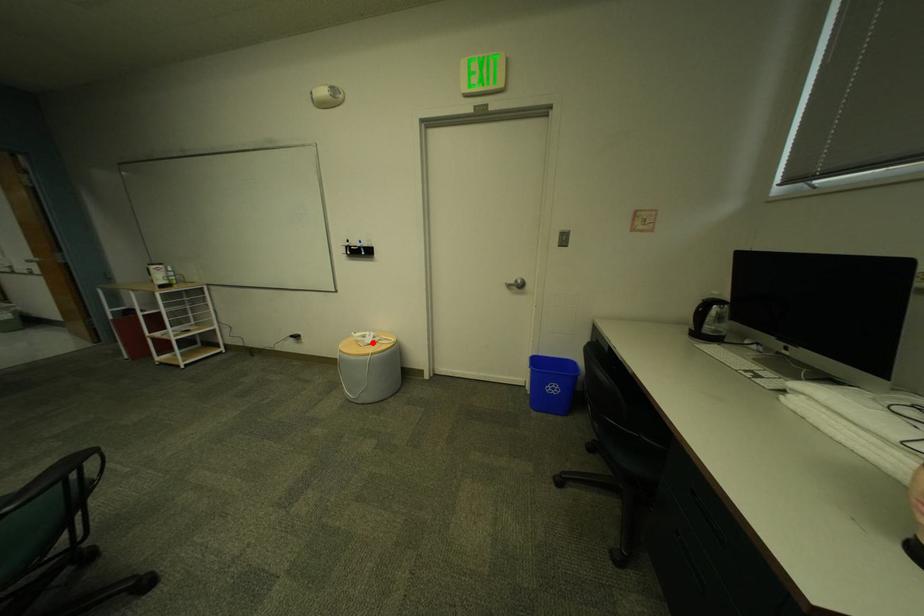
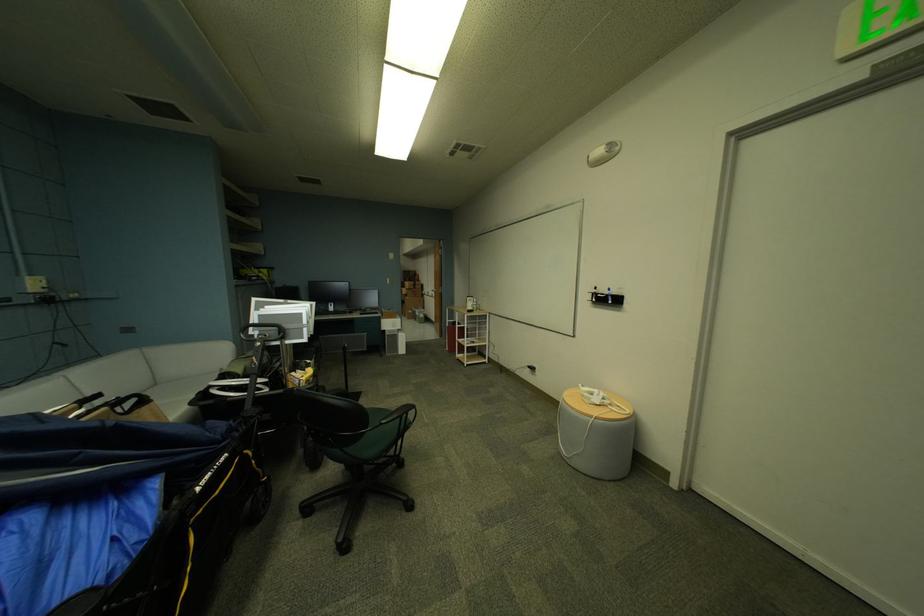
Locate, in the second image, the point that corresponds to the highlighted location in the first image.

(599, 400)